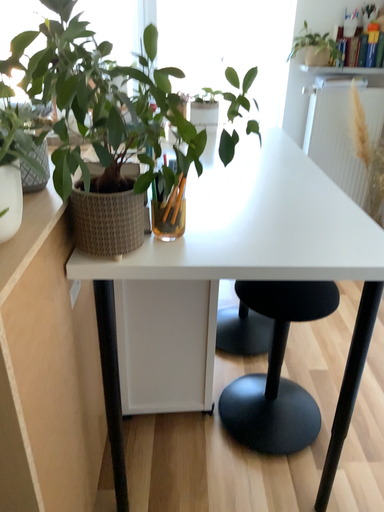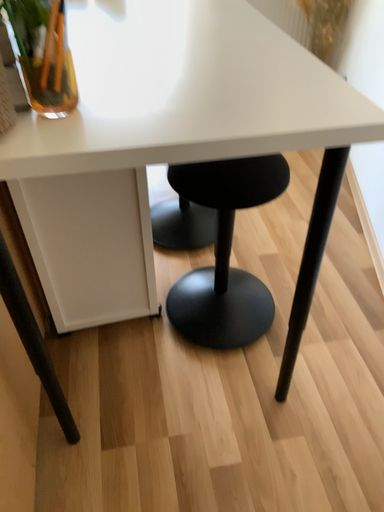
Question: How did the camera likely rotate when shooting the video?

Choices:
 (A) rotated left
 (B) rotated right

Answer: (B)